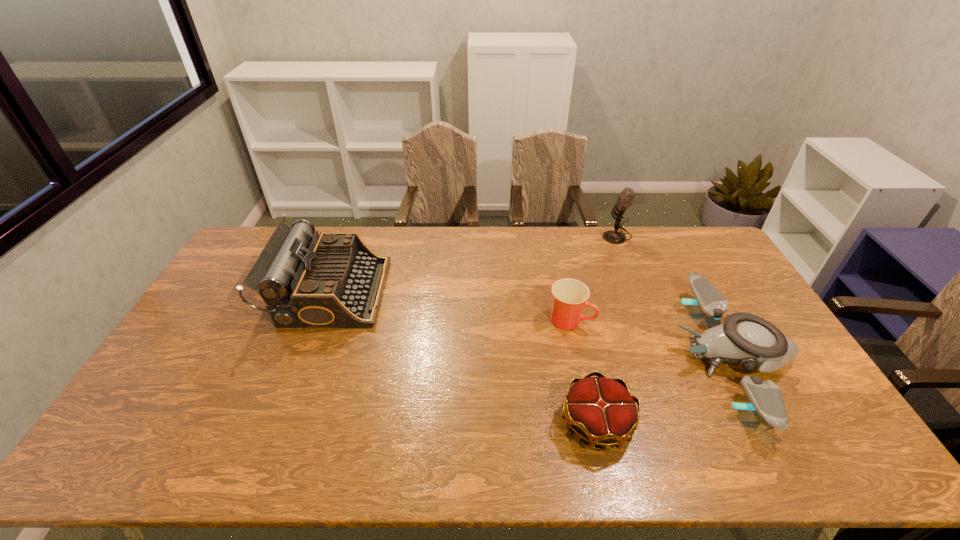
At what (x,y) coordinates should I click in order to perform the action: click on free space that is in between the cup and the leftmost object. Please return your answer as a coordinate pair (x, y). This screenshot has height=540, width=960. Looking at the image, I should click on (450, 306).

The width and height of the screenshot is (960, 540). Identify the location of vacant point located between the drone and the microphone. (675, 296).

Where is `vacant point located between the typewriter and the microphone`? The width and height of the screenshot is (960, 540). vacant point located between the typewriter and the microphone is located at coordinates (474, 264).

Find the location of `unoccupied position between the drone and the farthest object`. unoccupied position between the drone and the farthest object is located at coordinates (675, 296).

Where is `the fourth closest object to the cup`? The height and width of the screenshot is (540, 960). the fourth closest object to the cup is located at coordinates (333, 279).

This screenshot has height=540, width=960. Find the location of `object that ranks as the fourth closest to the microphone`. object that ranks as the fourth closest to the microphone is located at coordinates (333, 279).

Identify the location of vacant region that satisfies the following two spatial constraints: 1. on the back side of the cup; 2. on the keyboard of the leftmost object. This screenshot has width=960, height=540. (564, 292).

Where is `free spot that satisfies the following two spatial constraints: 1. on the keyboard of the typewriter; 2. on the right side of the cup`? This screenshot has height=540, width=960. free spot that satisfies the following two spatial constraints: 1. on the keyboard of the typewriter; 2. on the right side of the cup is located at coordinates (321, 320).

The image size is (960, 540). In order to click on free spot that satisfies the following two spatial constraints: 1. on the keyboard of the leftmost object; 2. on the right side of the crown in this screenshot , I will do `click(282, 423)`.

Locate an element on the screen. The image size is (960, 540). vacant space that satisfies the following two spatial constraints: 1. on the keyboard of the leftmost object; 2. on the right side of the crown is located at coordinates (282, 423).